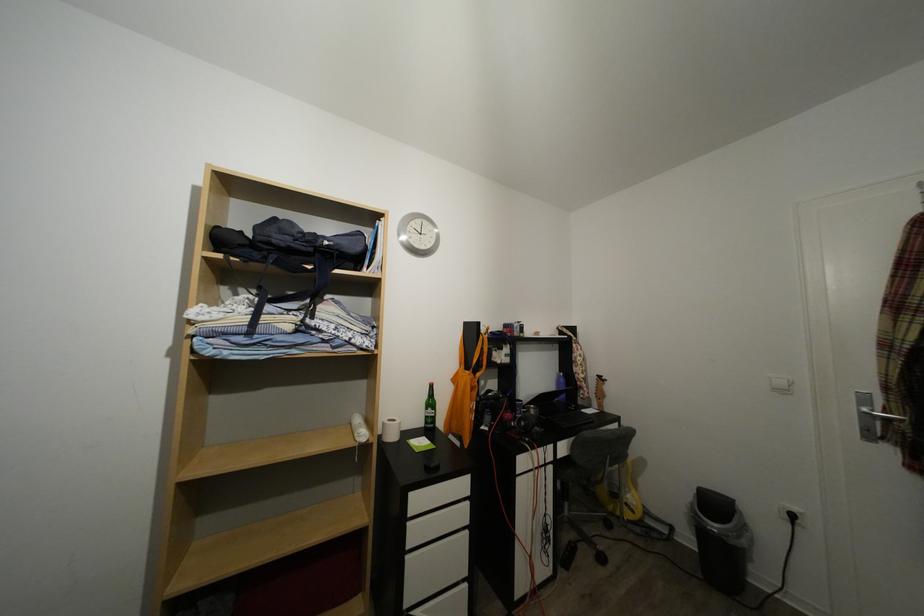
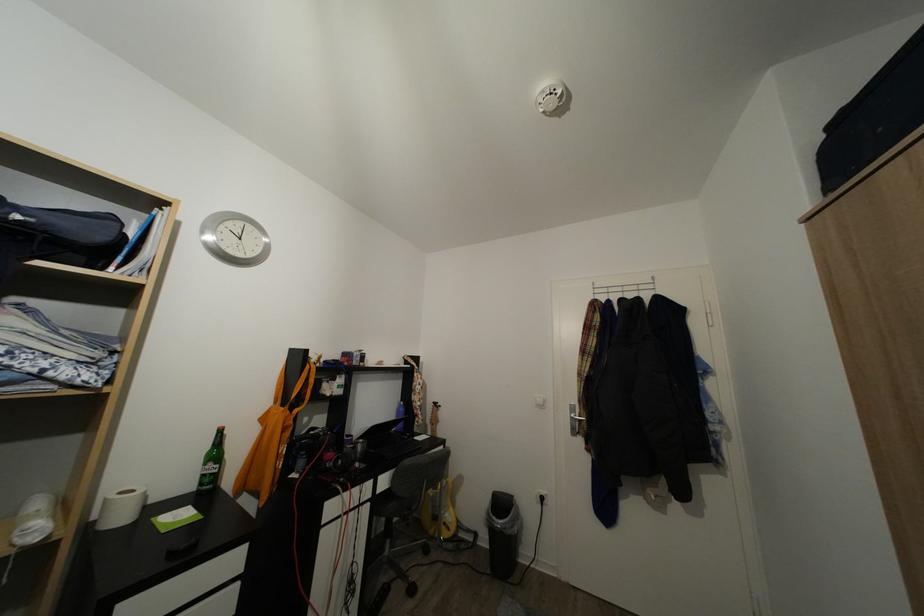
Find the pixel in the second image that matches the point at 334,249 in the first image.

(25, 223)